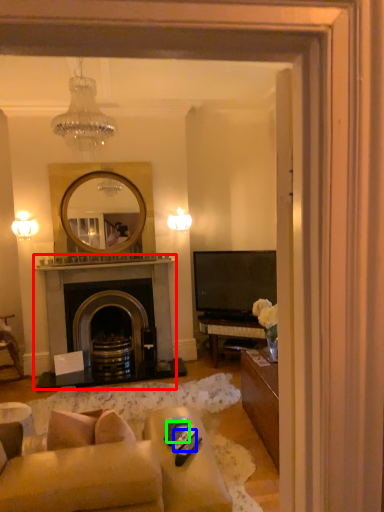
Question: Which object is the farthest from fireplace (highlighted by a red box)? Choose among these: remote control (highlighted by a blue box) or remote control (highlighted by a green box).

Choices:
 (A) remote control
 (B) remote control

Answer: (A)